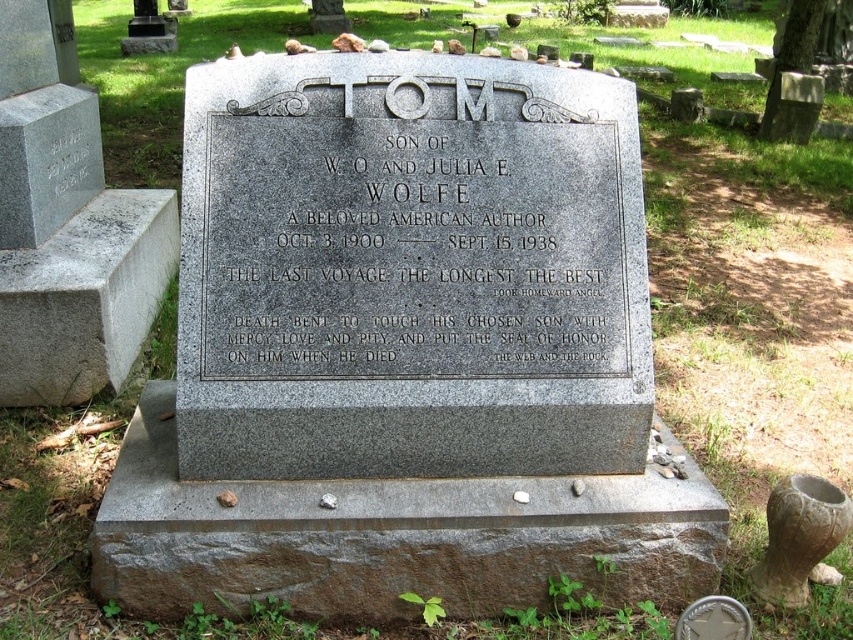
You are standing in front of a cemetery gravestone and notice two objects labeled as the gray granite plaque at center and the granite gravestone at center. According to the scene description, which object is positioned to the right of the other?

The gray granite plaque at center is to the right of the granite gravestone at center.